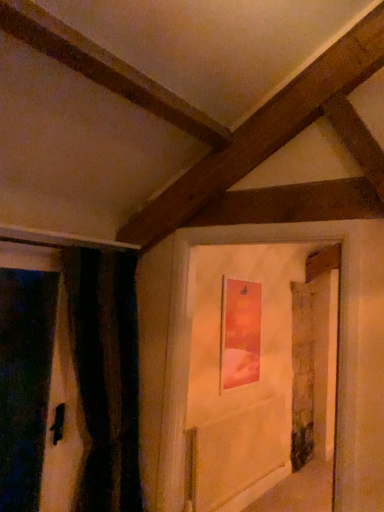
Measure the distance between point (x=254, y=322) and camera.

Point (x=254, y=322) is 11.76 feet from camera.

This screenshot has height=512, width=384. What do you see at coordinates (240, 333) in the screenshot?
I see `matte orange picture frame at center` at bounding box center [240, 333].

Identify the location of matte orange picture frame at center. This screenshot has height=512, width=384. (240, 333).

What is the approximate width of matte orange picture frame at center?

3.17 inches.

Find the location of a particular element. Image resolution: width=384 pixels, height=512 pixels. matte orange picture frame at center is located at coordinates (240, 333).